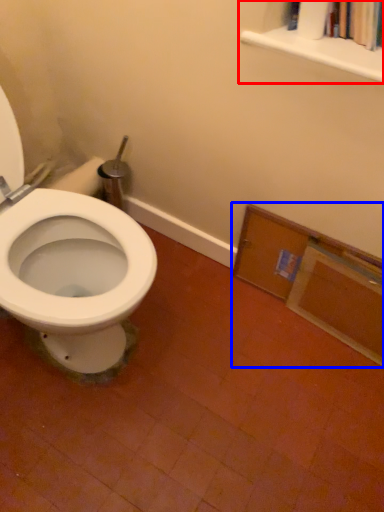
Question: Which point is further to the camera, bookcase (highlighted by a red box) or medicine cabinet (highlighted by a blue box)?

Choices:
 (A) bookcase
 (B) medicine cabinet

Answer: (B)